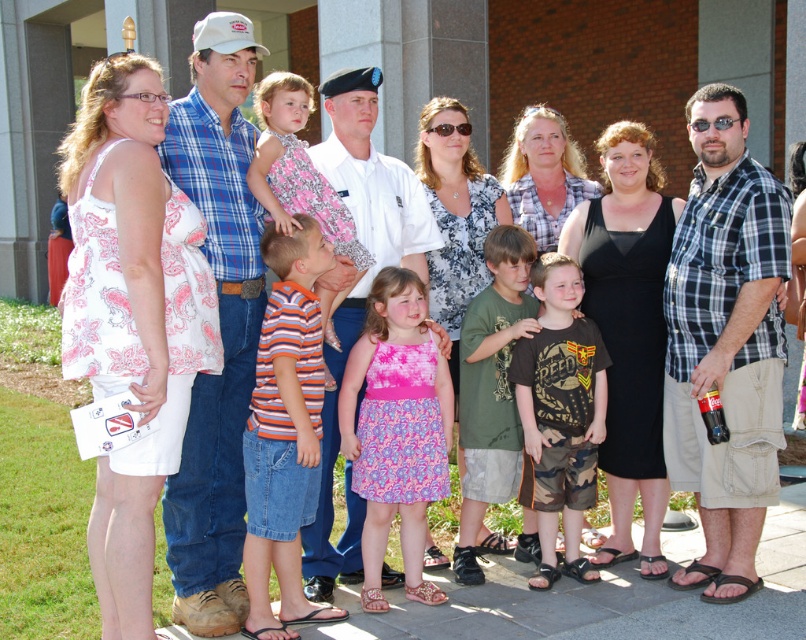
Does pink floral dress at center have a greater width compared to white uniform at center?

Incorrect, pink floral dress at center's width does not surpass white uniform at center's.

Can you confirm if pink floral dress at center is smaller than white uniform at center?

Correct, pink floral dress at center occupies less space than white uniform at center.

Locate an element on the screen. The image size is (806, 640). pink floral dress at center is located at coordinates (397, 428).

Between point (335, 124) and point (501, 456), which one is positioned behind?

Positioned behind is point (501, 456).

This screenshot has width=806, height=640. I want to click on white uniform at center, so click(x=358, y=291).

The image size is (806, 640). What are the coordinates of `white uniform at center` in the screenshot? It's located at (358, 291).

Which is below, blue plaid shirt at center or orange striped shirt at center?

orange striped shirt at center is below.

Measure the distance from blue plaid shirt at center to orange striped shirt at center.

They are 14.73 inches apart.

Locate an element on the screen. blue plaid shirt at center is located at coordinates (219, 324).